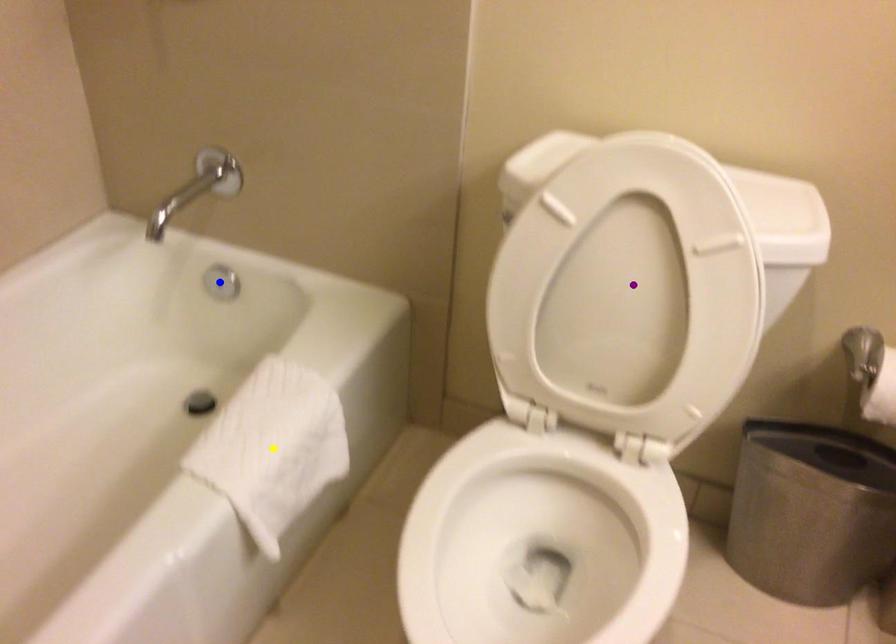
Order these from nearest to farthest:
1. purple point
2. yellow point
3. blue point

1. purple point
2. yellow point
3. blue point